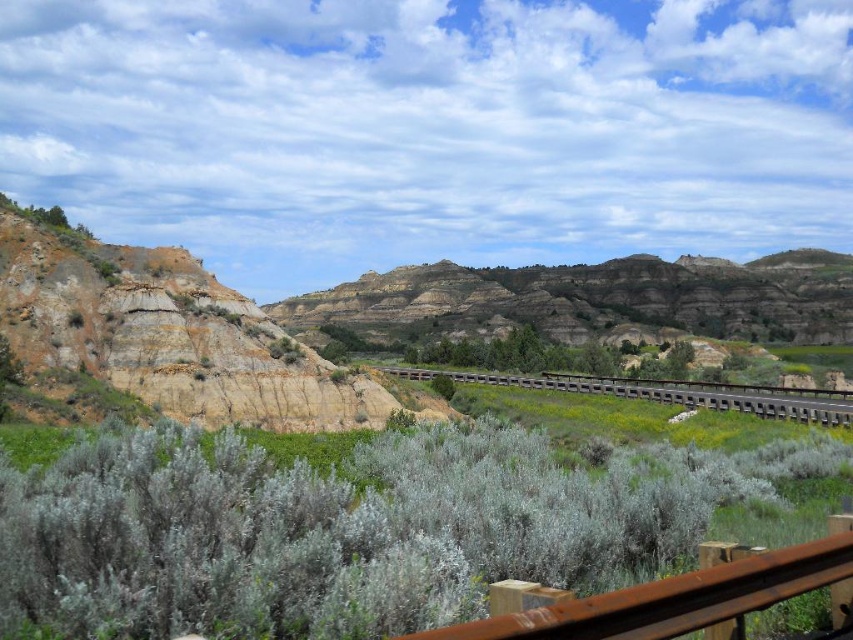
You are standing at the viewpoint and want to take a photo of the rustic brown rock formation at center and the brown wooden rail at center. Which object should you focus on first to ensure it appears sharp in your photo?

You should focus on the rustic brown rock formation at center first because it is closer to you than the brown wooden rail at center, so capturing it sharply will ensure the foreground element is in focus before adjusting for the background.

From the picture: You are a hiker who wants to take a photo of the rustic brown rock formation at center and the brown wooden rail at center from the viewpoint. Which object will appear higher in your camera frame?

The rustic brown rock formation at center appears higher in the camera frame because it is positioned above the brown wooden rail at center.

You are a hiker who wants to take a photo of the distant hills. You have a camera with a zoom lens that can only focus on objects within 2 meters of the camera. You are currently standing at the viewpoint and see the rusty metal rail at lower right and the brown wooden rail at center. Which rail should you stand behind to ensure the distant hills are in focus?

The rusty metal rail at lower right is much taller than the brown wooden rail at center. To ensure the distant hills are in focus, you should stand behind the brown wooden rail at center since it is shorter and less likely to block the view.